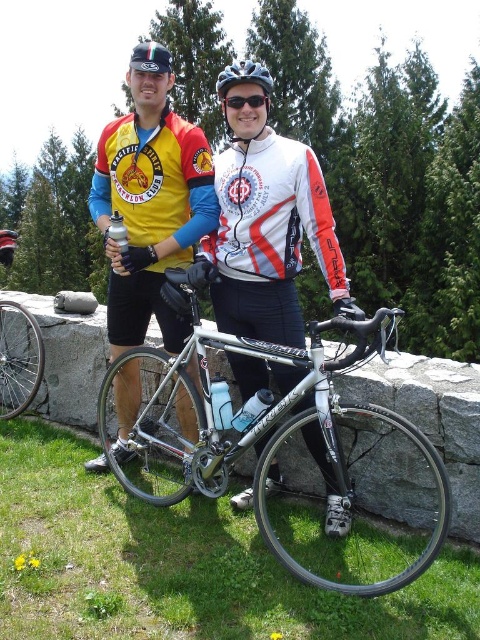
Question: Does matte black bicycle at center have a smaller size compared to silver metallic bicycle wheel at left?

Choices:
 (A) yes
 (B) no

Answer: (B)

Question: Estimate the real-world distances between objects in this image. Which object is closer to the matte black bicycle at center?

Choices:
 (A) silver metallic bicycle at center
 (B) white matte bicycle helmet at center
 (C) silver metallic bicycle wheel at left
 (D) matte black helmet at center

Answer: (A)

Question: Does matte yellow jersey at left have a smaller size compared to white matte bicycle helmet at center?

Choices:
 (A) no
 (B) yes

Answer: (B)

Question: Estimate the real-world distances between objects in this image. Which object is closer to the matte yellow jersey at left?

Choices:
 (A) silver metallic bicycle at center
 (B) matte black bicycle at center
 (C) black matte goggles at center
 (D) matte black helmet at center

Answer: (B)

Question: Is silver metallic bicycle at center further to the viewer compared to matte yellow jersey at left?

Choices:
 (A) no
 (B) yes

Answer: (A)

Question: Among these objects, which one is farthest from the camera?

Choices:
 (A) matte black bicycle at center
 (B) white matte bicycle helmet at center
 (C) matte yellow jersey at left

Answer: (C)